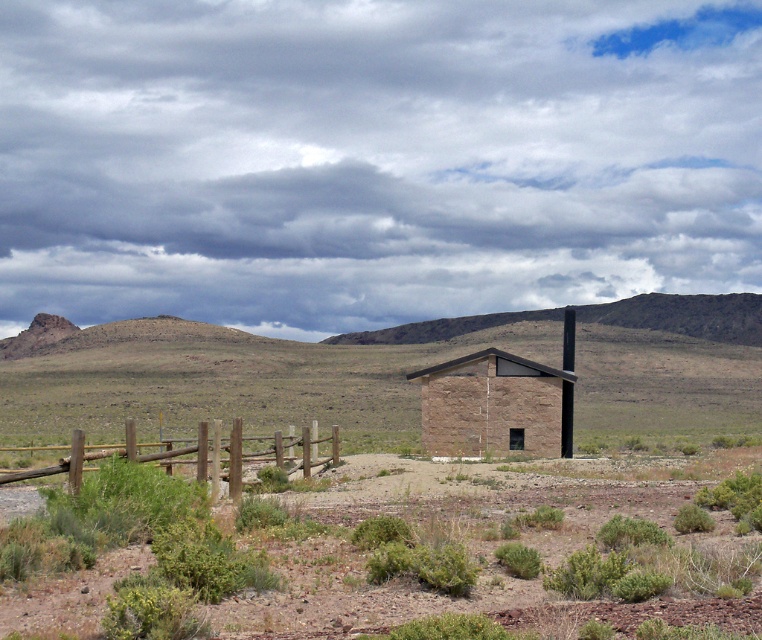
Question: Considering the real-world distances, which object is closest to the brown wooden fence at lower left?

Choices:
 (A) brown stone hut at center
 (B) green shrubbery at center

Answer: (B)

Question: Which point is closer to the camera?

Choices:
 (A) (27, 470)
 (B) (610, 580)

Answer: (B)

Question: Does brown stone hut at center have a larger size compared to brown wooden fence at lower left?

Choices:
 (A) no
 (B) yes

Answer: (A)

Question: Is the position of green shrubbery at center more distant than that of brown wooden fence at lower left?

Choices:
 (A) no
 (B) yes

Answer: (A)

Question: Which point appears closest to the camera in this image?

Choices:
 (A) (152, 456)
 (B) (572, 385)
 (C) (62, 624)

Answer: (C)

Question: Observing the image, what is the correct spatial positioning of green shrubbery at center in reference to brown wooden fence at lower left?

Choices:
 (A) right
 (B) left

Answer: (A)